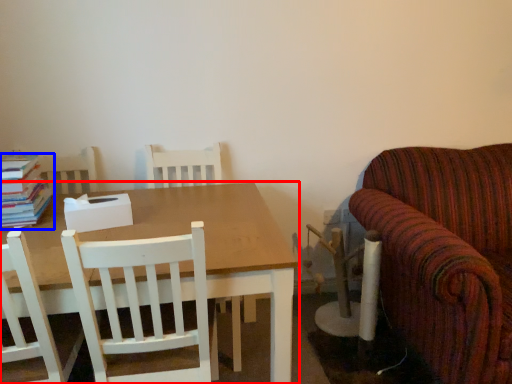
Question: Among these objects, which one is nearest to the camera, table (highlighted by a red box) or book (highlighted by a blue box)?

Choices:
 (A) table
 (B) book

Answer: (A)